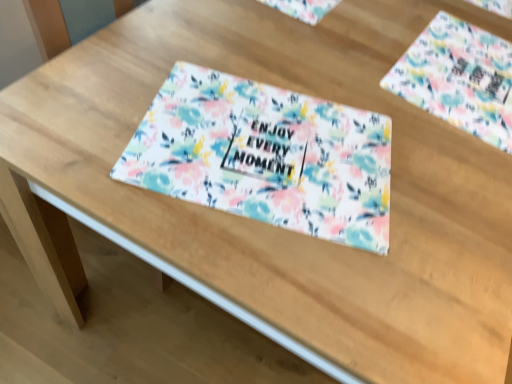
Question: Relative to floral fabric placemat at center, is floral fabric placemat at upper right in front or behind?

Choices:
 (A) front
 (B) behind

Answer: (B)

Question: Looking at their shapes, would you say floral fabric placemat at upper right is wider or thinner than floral fabric placemat at center?

Choices:
 (A) wide
 (B) thin

Answer: (A)

Question: Would you say floral fabric placemat at upper right is to the left or to the right of floral fabric placemat at center in the picture?

Choices:
 (A) right
 (B) left

Answer: (A)

Question: Is point (268, 157) positioned closer to the camera than point (483, 107)?

Choices:
 (A) closer
 (B) farther

Answer: (A)

Question: In the image, is floral fabric placemat at center on the left side or the right side of floral fabric placemat at upper right?

Choices:
 (A) left
 (B) right

Answer: (A)

Question: From a real-world perspective, relative to floral fabric placemat at upper right, is floral fabric placemat at center vertically above or below?

Choices:
 (A) above
 (B) below

Answer: (A)

Question: In terms of height, does floral fabric placemat at center look taller or shorter compared to floral fabric placemat at upper right?

Choices:
 (A) tall
 (B) short

Answer: (B)